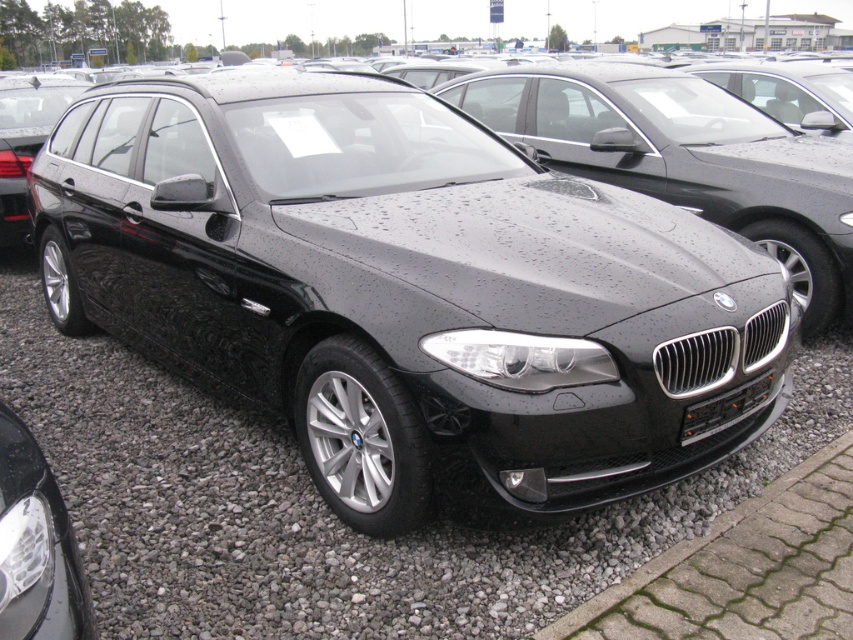
Which is above, gray gravel at center or black metallic license plate at center?

black metallic license plate at center is above.

Between point (148, 426) and point (747, 410), which one is positioned behind?

The point (148, 426) is behind.

In the scene shown: Who is more forward, (164,456) or (730,403)?

Point (730,403)

Where is `gray gravel at center`? This screenshot has width=853, height=640. gray gravel at center is located at coordinates [x=323, y=504].